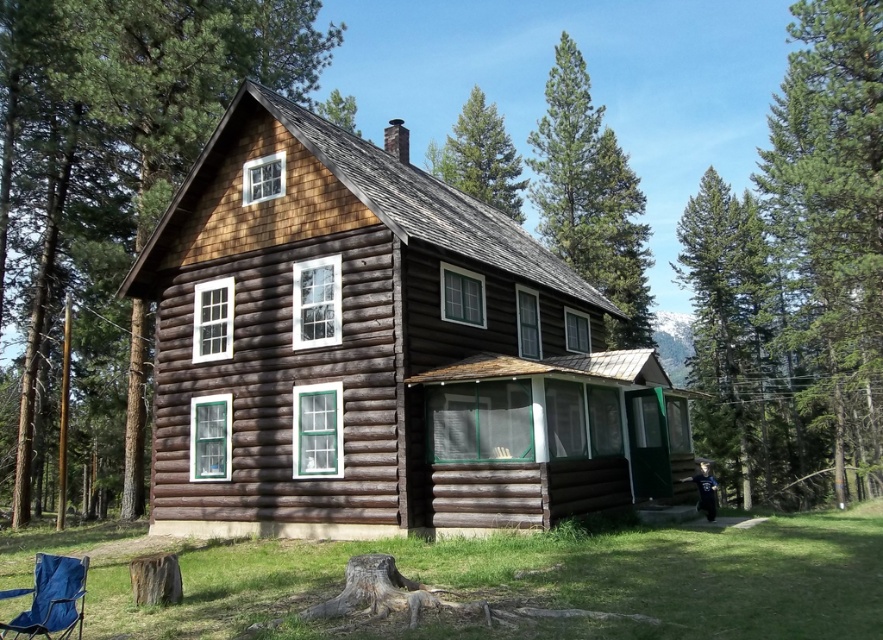
Question: Estimate the real-world distances between objects in this image. Which object is farther from the green textured pine tree at upper center?

Choices:
 (A) green pine tree at upper center
 (B) wooden log cabin at center
 (C) blue fabric chair at lower left
 (D) green coniferous tree at upper center

Answer: (C)

Question: Which point is closer to the camera?

Choices:
 (A) green coniferous tree at upper center
 (B) brown wooden house at center

Answer: (B)

Question: Is wooden log cabin at center above green coniferous tree at upper center?

Choices:
 (A) yes
 (B) no

Answer: (B)

Question: Does wooden log cabin at center appear on the right side of green textured tree at right?

Choices:
 (A) yes
 (B) no

Answer: (B)

Question: Which object is positioned closest to the green pine tree at upper center?

Choices:
 (A) green textured pine tree at upper center
 (B) green coniferous tree at upper center
 (C) green coniferous tree at right
 (D) green textured tree at right

Answer: (B)

Question: Is brown wooden house at center to the left of green textured pine tree at upper center from the viewer's perspective?

Choices:
 (A) no
 (B) yes

Answer: (B)